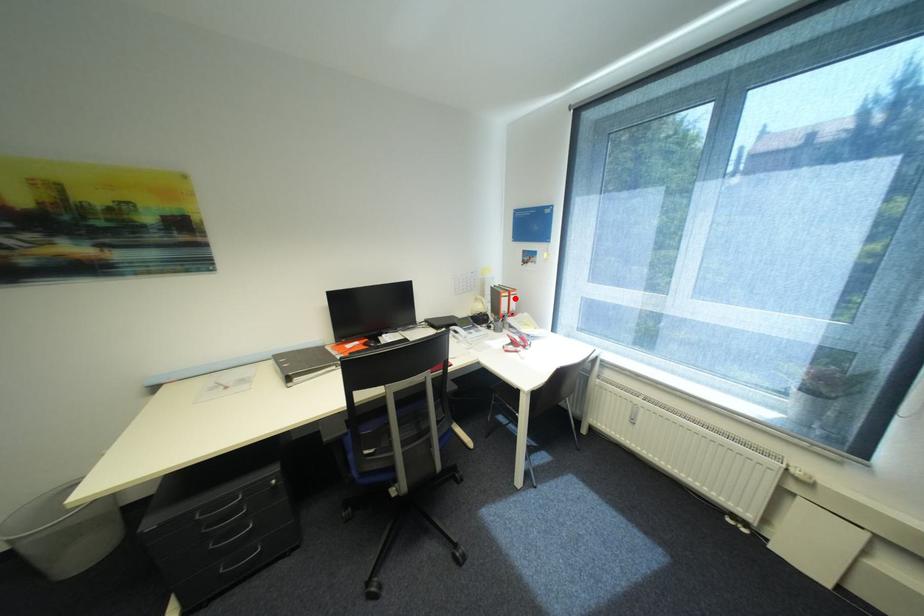
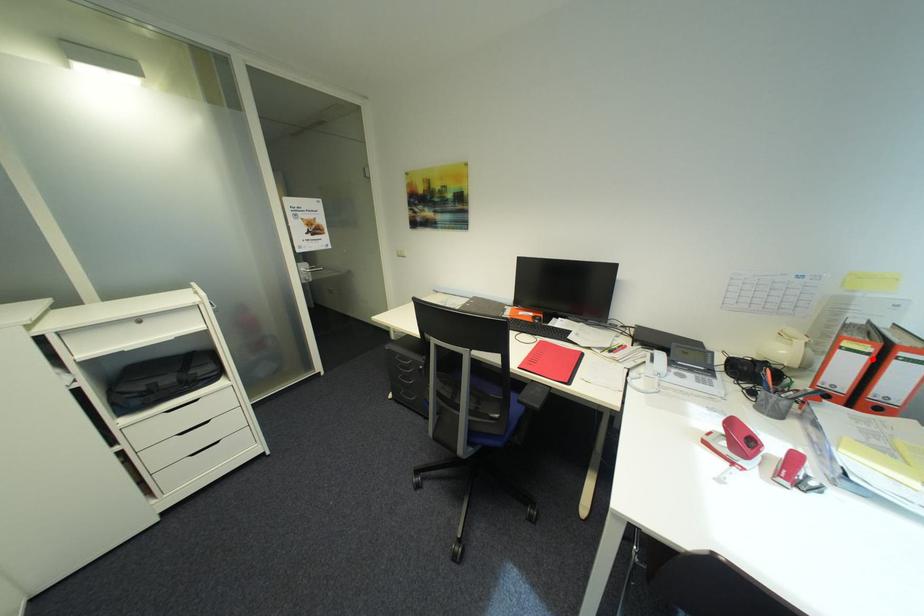
I am providing you with two images of the same scene from different viewpoints. A red point is marked on the first image and another point is marked on the second image. Is the red point in image1 aligned with the point shown in image2?

Yes